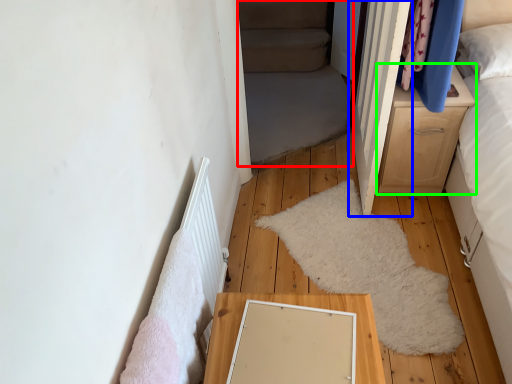
Question: Which object is the closest to the bed frame (highlighted by a red box)? Choose among these: door (highlighted by a blue box) or chest of drawers (highlighted by a green box).

Choices:
 (A) door
 (B) chest of drawers

Answer: (A)